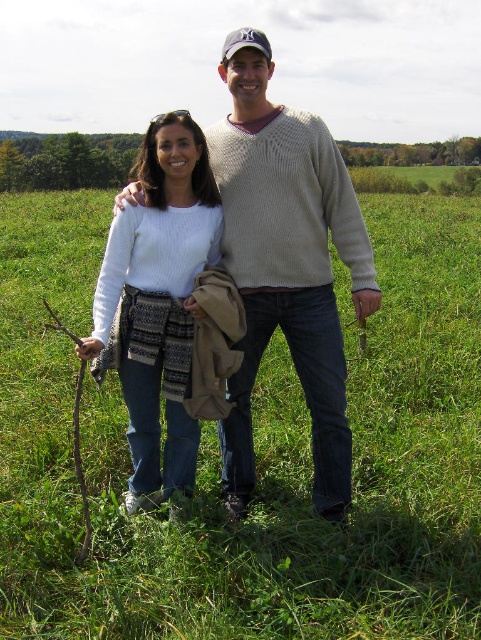
Which is in front, point (0, 525) or point (77, 452)?

Positioned in front is point (77, 452).

Which is more to the left, green grassy field at center or brown rough twig at lower left?

brown rough twig at lower left is more to the left.

Is point (255, 419) more distant than point (75, 404)?

Yes.

Image resolution: width=481 pixels, height=640 pixels. In order to click on green grassy field at center in this screenshot , I will do `click(255, 456)`.

Between white knitted sweater at center and brown rough twig at lower left, which one is positioned higher?

white knitted sweater at center

Is point (139, 218) positioned after point (46, 304)?

No, (139, 218) is closer to viewer.

Between point (177, 161) and point (75, 420), which one is positioned in front?

Point (75, 420) is in front.

Locate an element on the screen. The image size is (481, 640). white knitted sweater at center is located at coordinates (156, 301).

In the scene shown: Can you confirm if green grassy field at center is bigger than white knit sweater at center?

Indeed, green grassy field at center has a larger size compared to white knit sweater at center.

In order to click on green grassy field at center in this screenshot , I will do `click(255, 456)`.

Image resolution: width=481 pixels, height=640 pixels. In order to click on green grassy field at center in this screenshot , I will do `click(255, 456)`.